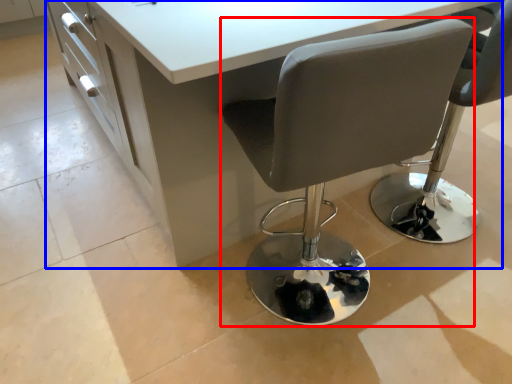
Question: Which object is closer to the camera taking this photo, chair (highlighted by a red box) or table (highlighted by a blue box)?

Choices:
 (A) chair
 (B) table

Answer: (A)